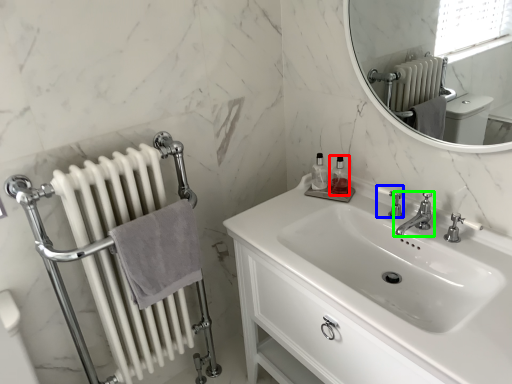
Question: Which object is the farthest from toiletry (highlighted by a red box)? Choose among these: plumbing fixture (highlighted by a blue box) or tap (highlighted by a green box).

Choices:
 (A) plumbing fixture
 (B) tap

Answer: (B)